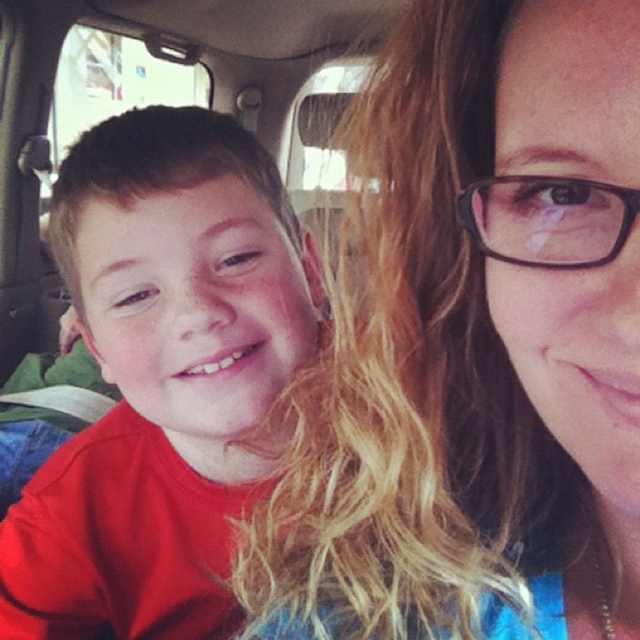
You are a photographer trying to capture a photo of the two people in the vehicle. Since the matte red shirt at left is shorter than the blonde hair at center, which object should you adjust your camera angle to focus on first to ensure both are in frame?

Since the blonde hair at center is taller than the matte red shirt at left, you should focus on the blonde hair at center first to ensure both are in frame.

From the picture: You are a photographer trying to capture a closeup of the blonde hair at center and the matte red shirt at left. Given their sizes, which object should you zoom in on more to ensure both are in focus?

Since the blonde hair at center is smaller than the matte red shirt at left, you should zoom in more on the blonde hair at center to ensure both are in focus.